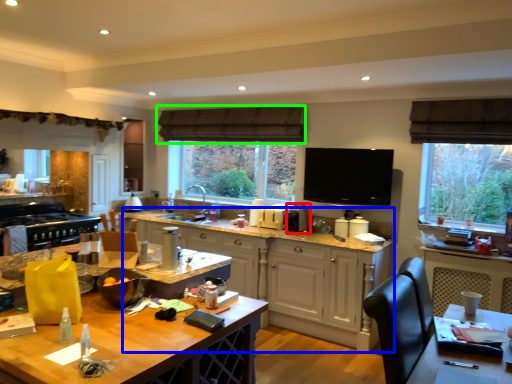
Question: Which object is the farthest from appliance (highlighted by a red box)? Choose among these: cabinetry (highlighted by a blue box) or exhaust hood (highlighted by a green box).

Choices:
 (A) cabinetry
 (B) exhaust hood

Answer: (B)